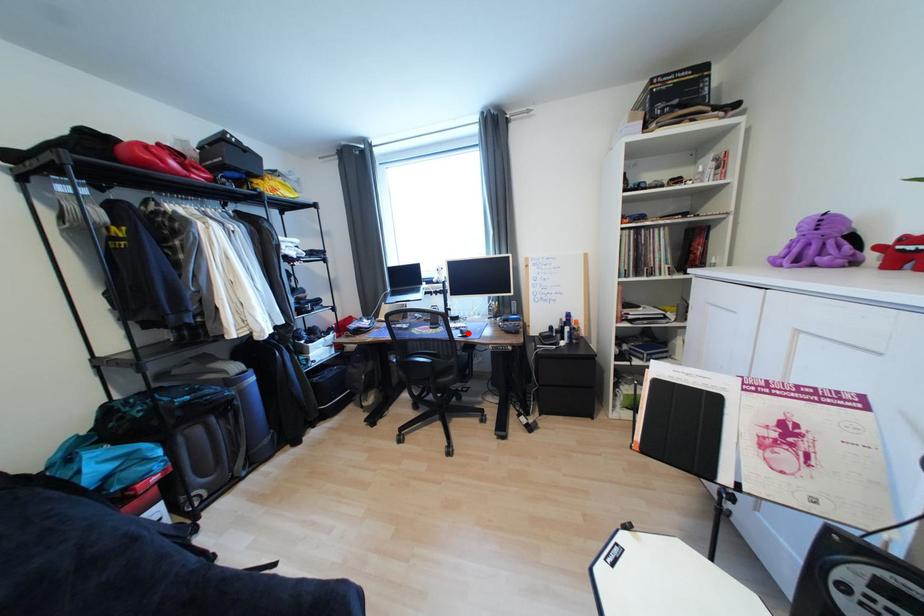
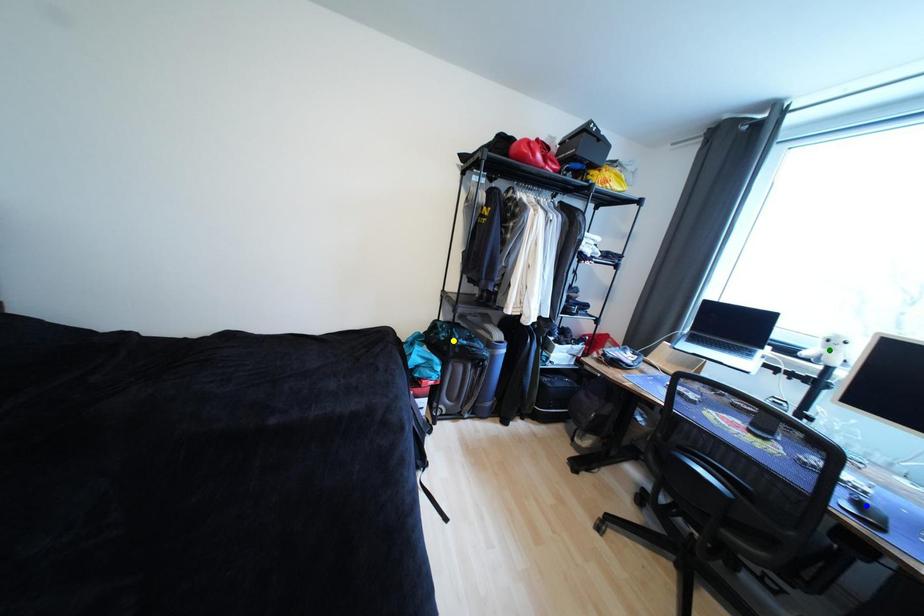
Question: I am providing you with two images of the same scene from different viewpoints. A red point is marked on the first image. You are given multiple points on the second image. Which spot in image 2 lines up with the point in image 1?

Choices:
 (A) blue point
 (B) yellow point
 (C) green point

Answer: (A)